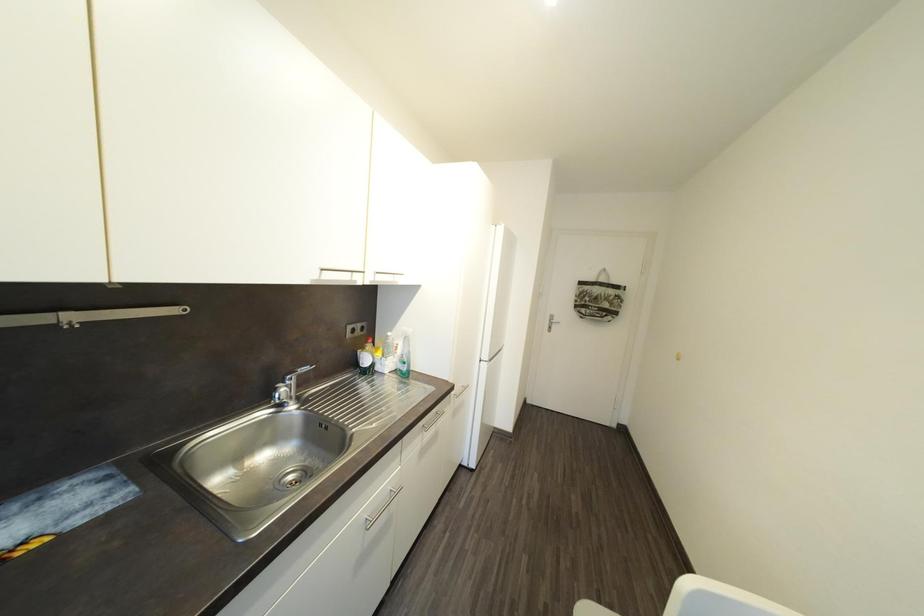
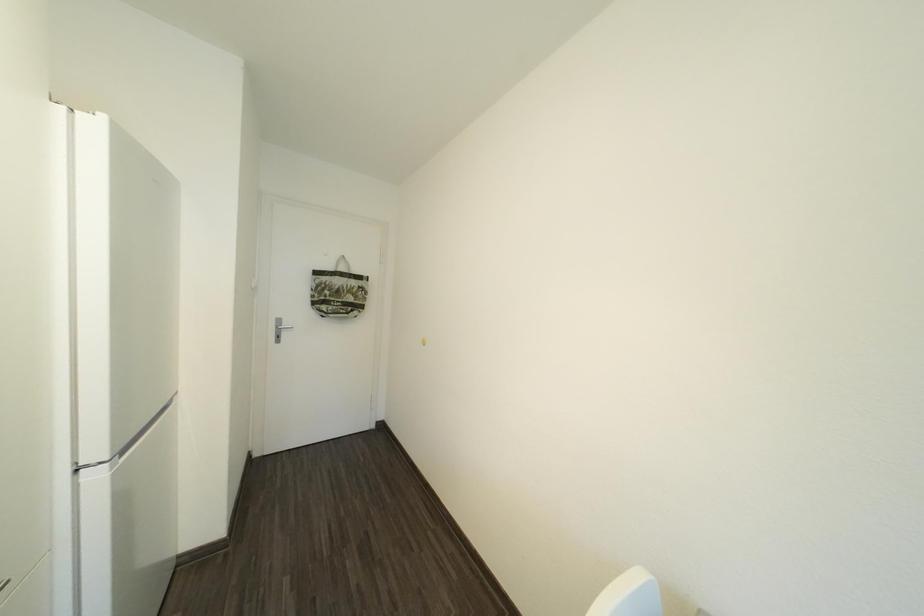
Question: The camera is either moving clockwise (left) or counter-clockwise (right) around the object. The first image is from the beginning of the video and the second image is from the end. Is the camera moving left or right when shooting the video?

Choices:
 (A) Left
 (B) Right

Answer: (A)